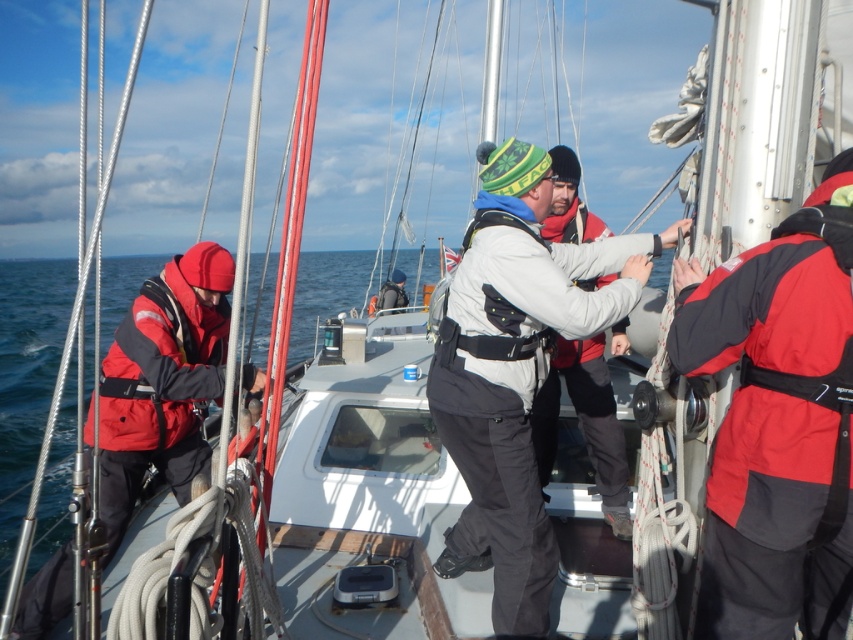
Question: Considering the relative positions of red/black neoprene life jacket at right and red matte jacket at left in the image provided, where is red/black neoprene life jacket at right located with respect to red matte jacket at left?

Choices:
 (A) left
 (B) right

Answer: (B)

Question: Considering the real-world distances, which object is closest to the red matte jacket at left?

Choices:
 (A) white fleece jacket at center
 (B) gray synthetic life jacket at center
 (C) red softshell jacket at left
 (D) red/black neoprene life jacket at right

Answer: (C)

Question: Is red matte jacket at left bigger than red softshell jacket at left?

Choices:
 (A) yes
 (B) no

Answer: (A)

Question: Which point appears farthest from the camera in this image?

Choices:
 (A) (840, 368)
 (B) (178, 285)
 (C) (581, 355)
 (D) (502, 236)

Answer: (C)

Question: Can you confirm if red/black neoprene life jacket at right is wider than gray synthetic life jacket at center?

Choices:
 (A) yes
 (B) no

Answer: (B)

Question: Which is nearer to the white fleece jacket at center?

Choices:
 (A) red/black neoprene life jacket at right
 (B) gray synthetic life jacket at center
 (C) red softshell jacket at left

Answer: (B)